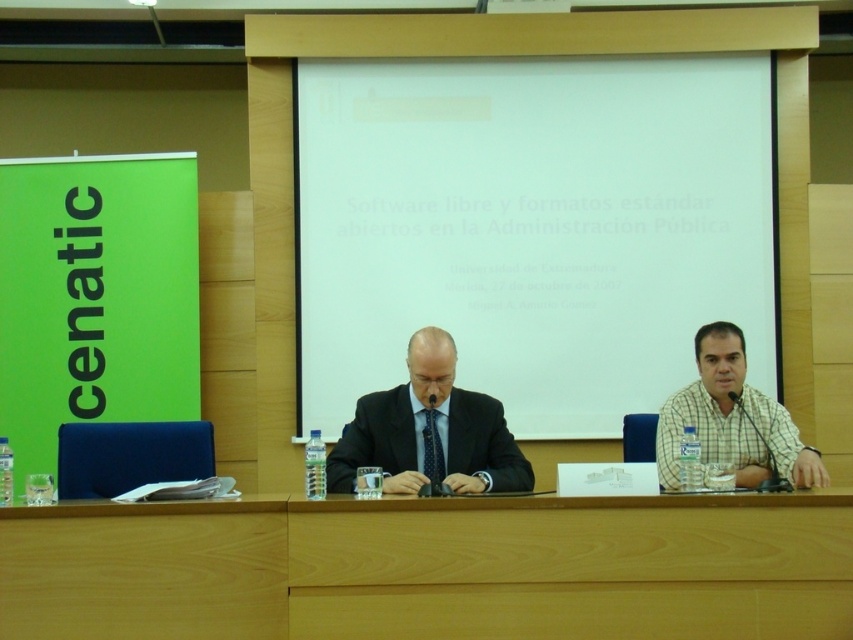
Between point (527, 316) and point (387, 484), which one is positioned behind?

The point (527, 316) is more distant.

Is white matte projector screen at center thinner than matte black suit at center?

In fact, white matte projector screen at center might be wider than matte black suit at center.

Describe the element at coordinates (532, 228) in the screenshot. I see `white matte projector screen at center` at that location.

Locate an element on the screen. The width and height of the screenshot is (853, 640). white matte projector screen at center is located at coordinates (532, 228).

Does white matte projector screen at center appear on the right side of light brown wood table at lower center?

Correct, you'll find white matte projector screen at center to the right of light brown wood table at lower center.

Can you confirm if white matte projector screen at center is wider than light brown wood table at lower center?

Indeed, white matte projector screen at center has a greater width compared to light brown wood table at lower center.

I want to click on white matte projector screen at center, so (532, 228).

Is point (749, 515) behind point (256, 550)?

Yes, it is.

Does light brown wood table at center have a greater width compared to light brown wood table at lower center?

Yes, light brown wood table at center is wider than light brown wood table at lower center.

You are a GUI agent. You are given a task and a screenshot of the screen. Output one action in this format:
    pyautogui.click(x=<x>, y=<y>)
    Task: Click on the light brown wood table at center
    
    Given the screenshot: What is the action you would take?
    pyautogui.click(x=572, y=568)